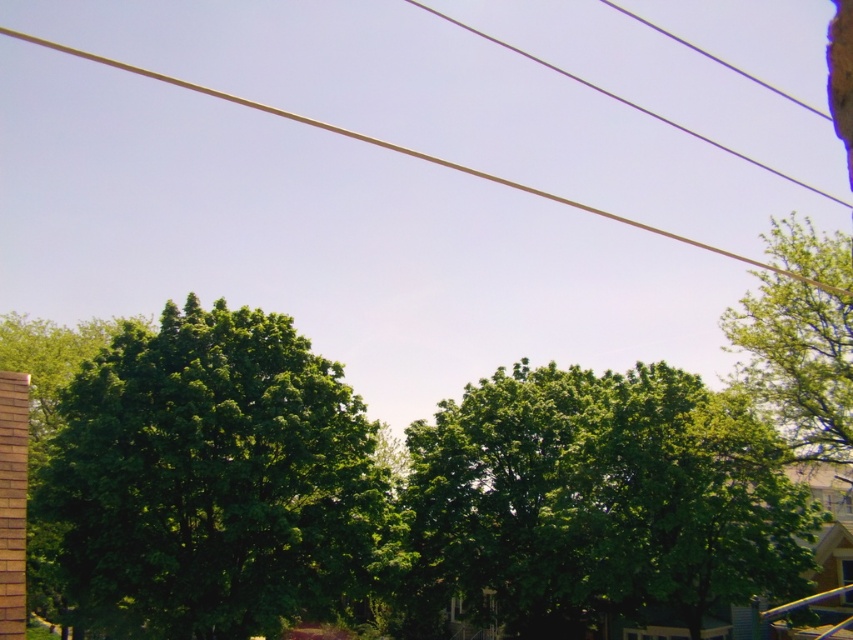
Looking at this image, does green leafy tree at left appear on the right side of green leafy tree at upper right?

No, green leafy tree at left is not to the right of green leafy tree at upper right.

Which is in front, point (308, 552) or point (840, 362)?

Point (840, 362) is more forward.

In order to click on green leafy tree at left in this screenshot , I will do `click(213, 477)`.

Can you confirm if green leafy tree at left is bigger than green leafy tree at center?

Incorrect, green leafy tree at left is not larger than green leafy tree at center.

Which of these two, green leafy tree at left or green leafy tree at center, stands taller?

green leafy tree at center is taller.

Between point (76, 556) and point (759, 442), which one is positioned behind?

Point (76, 556)

Where is `green leafy tree at left`? green leafy tree at left is located at coordinates (213, 477).

The height and width of the screenshot is (640, 853). What do you see at coordinates (213, 477) in the screenshot?
I see `green leafy tree at left` at bounding box center [213, 477].

Between green leafy tree at left and smooth wire at upper center, which one has less height?

green leafy tree at left is shorter.

Which is behind, point (267, 614) or point (619, 218)?

Point (619, 218)

I want to click on green leafy tree at left, so click(x=213, y=477).